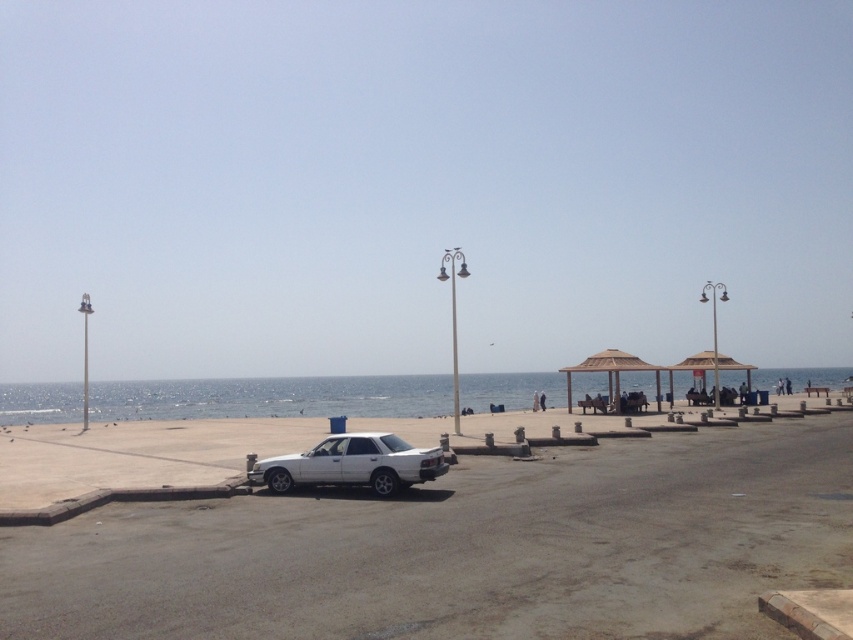
You are a photographer standing on the sandy beach. You want to take a photo that includes both the blue water at center and the brown wooden gazebo at center. Based on their positions, which object will appear larger in the photo?

The blue water at center will appear larger in the photo because it is much taller than the brown wooden gazebo at center.

You are driving a car that is 4.5 meters long. You want to park your car between the white matte car at lower left and the nearest lamppost with dual lights. Is there enough space for your car?

The distance between the white matte car at lower left and the nearest lamppost with dual lights is 7.38 meters. Since your car is 4.5 meters long, there is sufficient space to park between them as 7.38 meters is greater than 4.5 meters.

Consider the image. You are planning to park your vehicle in this coastal area and want to know if the white matte car at lower left can fit into the parking space currently occupied by the white matte sedan at center. Based on their widths, can it fit?

The white matte car at lower left might be wider than the white matte sedan at center, so there is a possibility that it may not fit into the parking space without adjustments.